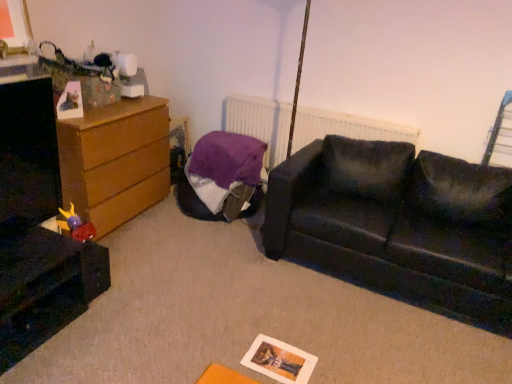
Where is `vacant space to the right of black glossy file cabinet at lower left`? The height and width of the screenshot is (384, 512). vacant space to the right of black glossy file cabinet at lower left is located at coordinates (102, 328).